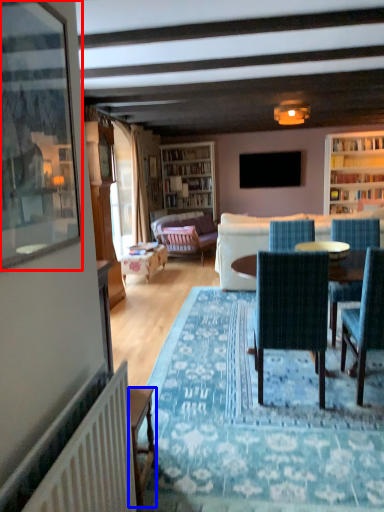
Question: Which object is closer to the camera taking this photo, picture frame (highlighted by a red box) or desk (highlighted by a blue box)?

Choices:
 (A) picture frame
 (B) desk

Answer: (A)